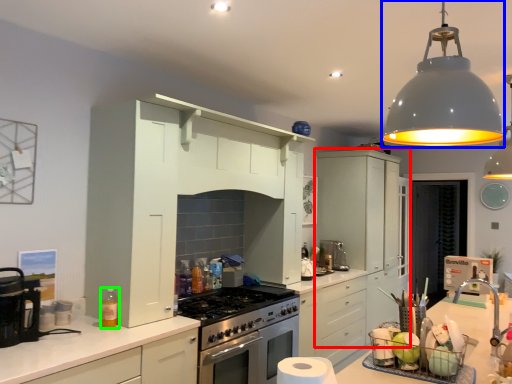
Question: Which object is positioned farthest from cabinetry (highlighted by a red box)? Select from light fixture (highlighted by a blue box) and bottle (highlighted by a green box).

Choices:
 (A) light fixture
 (B) bottle

Answer: (A)